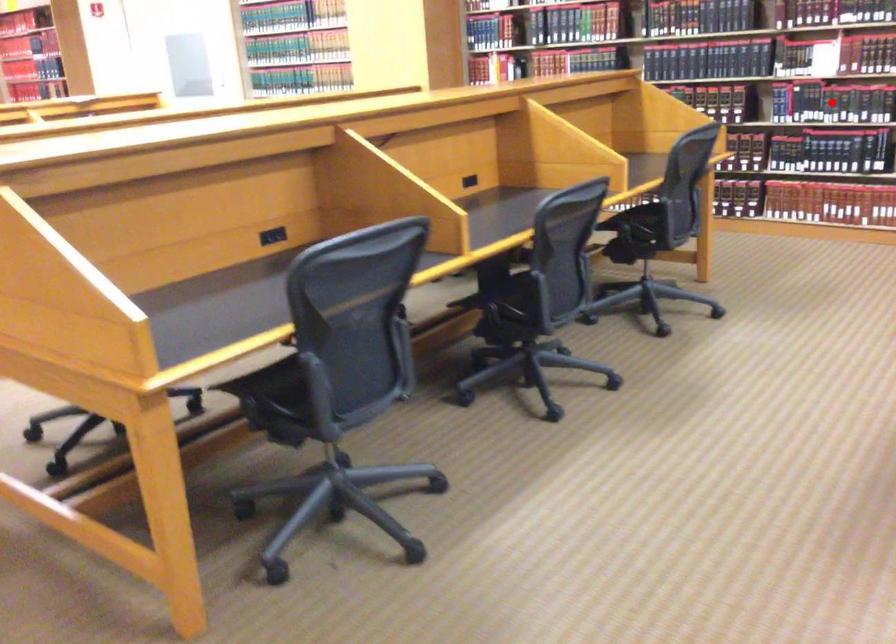
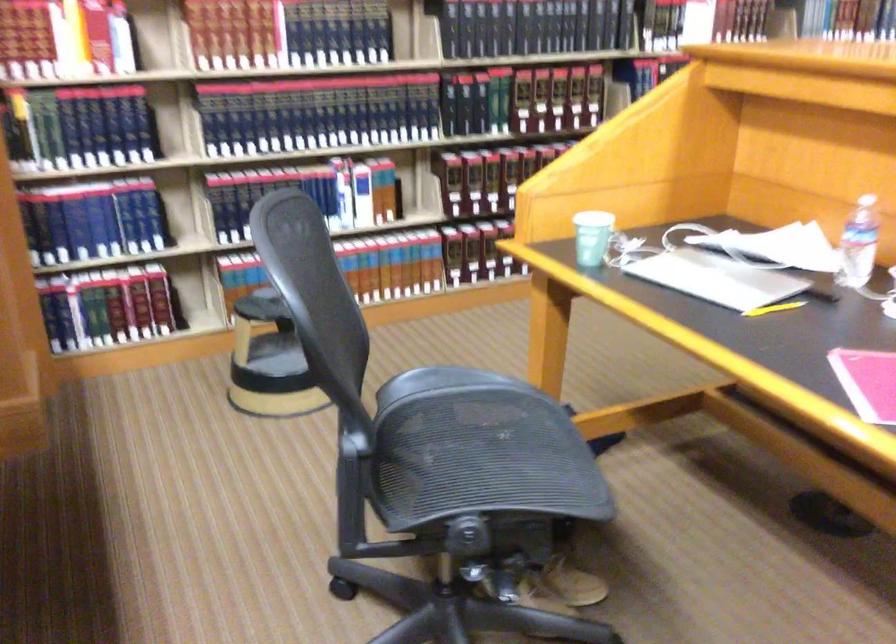
Question: I am providing you with two images of the same scene from different viewpoints. A red point is marked on the first image. Is the red point's position out of view in image 2?

Choices:
 (A) Yes
 (B) No

Answer: (A)